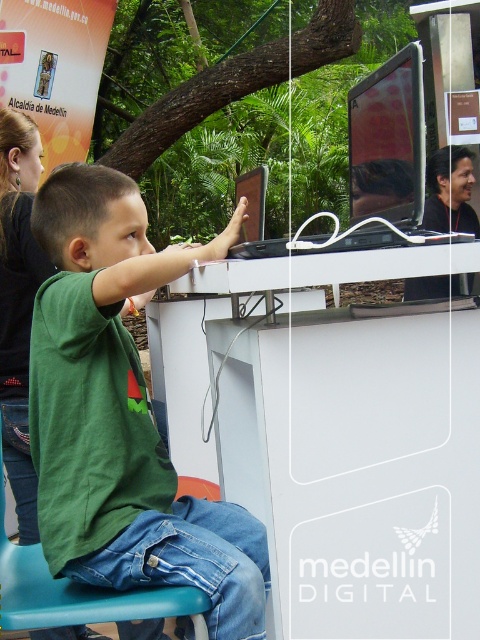
Question: Which object is farther from the camera taking this photo?

Choices:
 (A) green matte shirt at center
 (B) blue plastic chair at lower left

Answer: (B)

Question: Which of the following is the closest to the observer?

Choices:
 (A) blue plastic chair at lower left
 (B) green matte shirt at center

Answer: (B)

Question: Can you confirm if green matte shirt at center is bigger than blue plastic chair at lower left?

Choices:
 (A) yes
 (B) no

Answer: (A)

Question: Is matte black monitor at center smaller than blue plastic chair at lower left?

Choices:
 (A) no
 (B) yes

Answer: (A)

Question: Which is farther from the matte black monitor at center?

Choices:
 (A) blue plastic chair at lower left
 (B) green matte shirt at center

Answer: (A)

Question: Is green matte shirt at center bigger than matte black monitor at center?

Choices:
 (A) yes
 (B) no

Answer: (A)